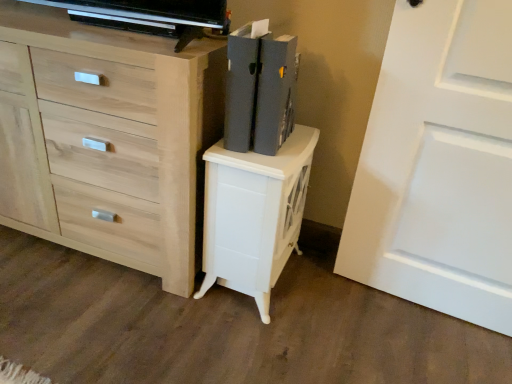
Question: Is light wood chest of drawers at center thinner than matte gray book at upper right?

Choices:
 (A) yes
 (B) no

Answer: (B)

Question: Is light wood chest of drawers at center smaller than matte gray book at upper right?

Choices:
 (A) no
 (B) yes

Answer: (A)

Question: Considering the relative sizes of light wood chest of drawers at center and matte gray book at upper right in the image provided, is light wood chest of drawers at center taller than matte gray book at upper right?

Choices:
 (A) no
 (B) yes

Answer: (B)

Question: From a real-world perspective, is light wood chest of drawers at center physically below matte gray book at upper right?

Choices:
 (A) yes
 (B) no

Answer: (A)

Question: Is light wood chest of drawers at center positioned far away from matte gray book at upper right?

Choices:
 (A) yes
 (B) no

Answer: (B)

Question: Considering the relative sizes of light wood chest of drawers at center and matte gray book at upper right in the image provided, is light wood chest of drawers at center shorter than matte gray book at upper right?

Choices:
 (A) no
 (B) yes

Answer: (A)

Question: Is the position of white glossy nightstand at center more distant than that of white matte door at right?

Choices:
 (A) yes
 (B) no

Answer: (A)

Question: From the image's perspective, would you say white glossy nightstand at center is positioned over white matte door at right?

Choices:
 (A) no
 (B) yes

Answer: (A)

Question: Does white glossy nightstand at center appear on the right side of white matte door at right?

Choices:
 (A) yes
 (B) no

Answer: (B)

Question: Can you confirm if white glossy nightstand at center is wider than white matte door at right?

Choices:
 (A) no
 (B) yes

Answer: (B)

Question: Would you say white glossy nightstand at center is a long distance from white matte door at right?

Choices:
 (A) yes
 (B) no

Answer: (B)

Question: Is white glossy nightstand at center taller than white matte door at right?

Choices:
 (A) yes
 (B) no

Answer: (B)

Question: Does matte gray book at upper right lie behind white matte door at right?

Choices:
 (A) yes
 (B) no

Answer: (A)